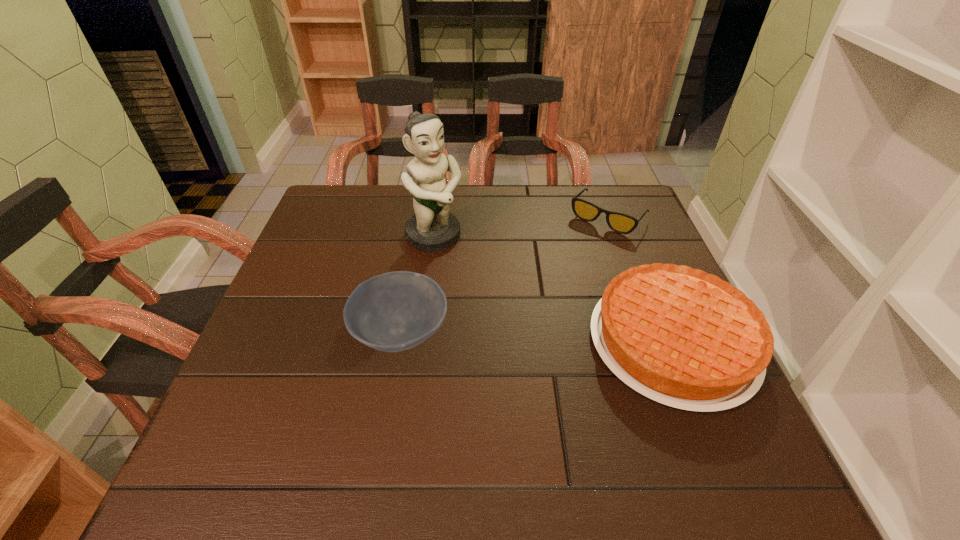
This screenshot has height=540, width=960. Find the location of `bowl`. bowl is located at coordinates (395, 311).

The height and width of the screenshot is (540, 960). What are the coordinates of `pie` in the screenshot? It's located at (679, 336).

This screenshot has width=960, height=540. Find the location of `the shortest object`. the shortest object is located at coordinates (621, 223).

The width and height of the screenshot is (960, 540). What are the coordinates of `figurine` in the screenshot? It's located at (432, 228).

Where is `vacant region located 0.290m on the back of the bowl`? vacant region located 0.290m on the back of the bowl is located at coordinates (420, 225).

Where is `free region located on the back of the pie`? The width and height of the screenshot is (960, 540). free region located on the back of the pie is located at coordinates (614, 198).

Find the location of `free location located on the front-facing side of the sunglasses`. free location located on the front-facing side of the sunglasses is located at coordinates (564, 267).

The width and height of the screenshot is (960, 540). I want to click on free space located on the front-facing side of the sunglasses, so click(579, 250).

The image size is (960, 540). In order to click on vacant region located 0.400m on the front-facing side of the sunglasses in this screenshot , I will do `click(515, 327)`.

The image size is (960, 540). I want to click on vacant space situated 0.300m on the front-facing side of the figurine, so click(521, 323).